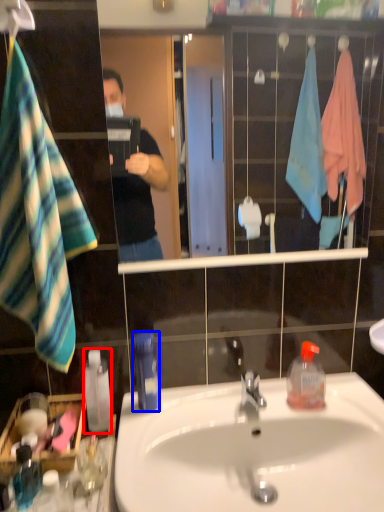
Question: Which point is further to the camera, bottle (highlighted by a red box) or bottle (highlighted by a blue box)?

Choices:
 (A) bottle
 (B) bottle

Answer: (A)